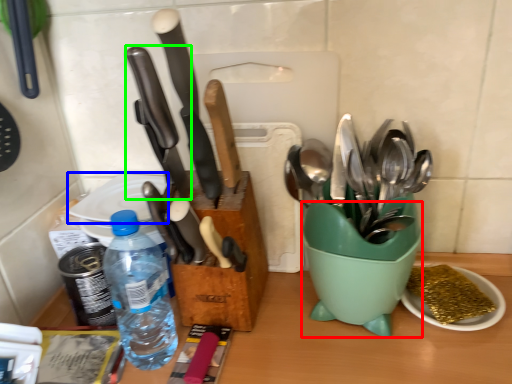
Question: Considering the real-world distances, which object is closest to mixing bowl (highlighted by a red box)? plate (highlighted by a blue box) or kitchen knife (highlighted by a green box).

Choices:
 (A) plate
 (B) kitchen knife

Answer: (B)